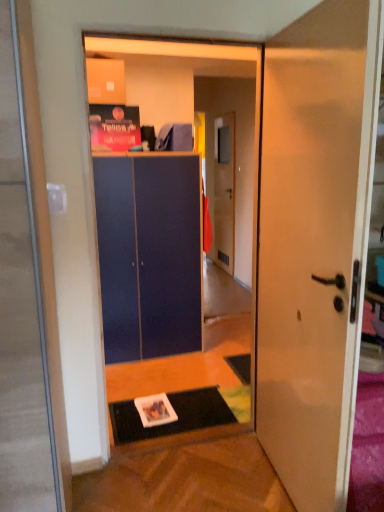
Image resolution: width=384 pixels, height=512 pixels. I want to click on unoccupied area in front of matte blue cabinet at center, so click(157, 380).